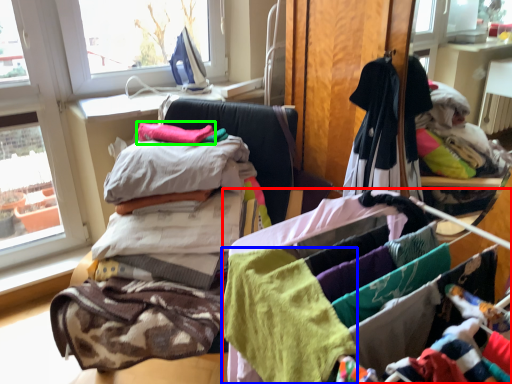
Question: Which object is the closest to the material (highlighted by a red box)? Choose among these: baby clothe (highlighted by a blue box) or baby clothe (highlighted by a green box).

Choices:
 (A) baby clothe
 (B) baby clothe

Answer: (A)